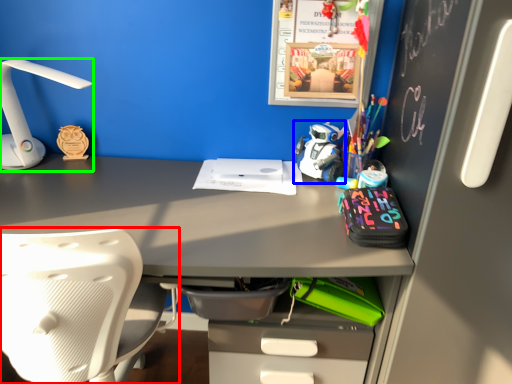
Question: Estimate the real-world distances between objects in this image. Which object is farther from chair (highlighted by a red box), toy (highlighted by a blue box) or lamp (highlighted by a green box)?

Choices:
 (A) toy
 (B) lamp

Answer: (A)